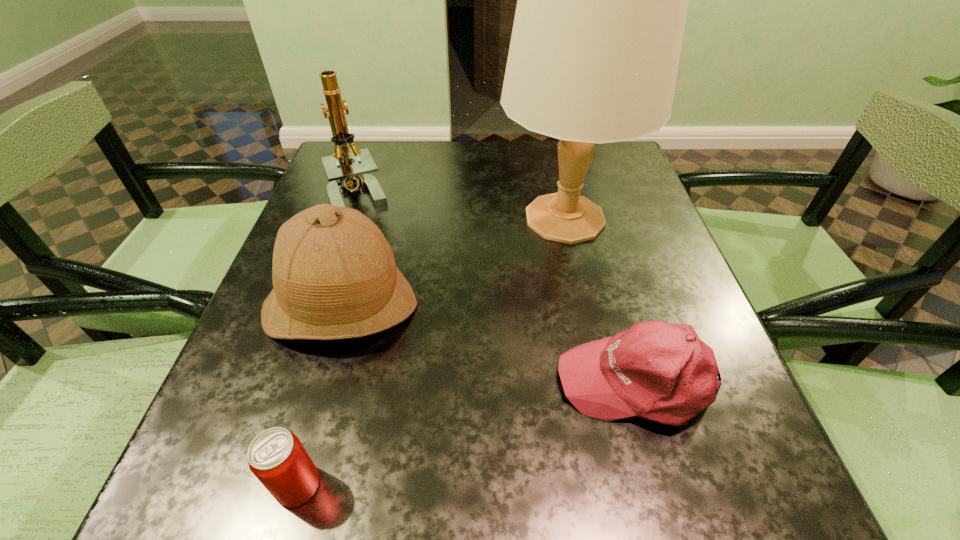
Find the location of a particular element. This screenshot has width=960, height=540. the tallest object is located at coordinates (602, 0).

Image resolution: width=960 pixels, height=540 pixels. I want to click on the second tallest object, so click(344, 175).

Where is `the third tallest object`? The height and width of the screenshot is (540, 960). the third tallest object is located at coordinates (334, 275).

Where is `baseball cap`? baseball cap is located at coordinates (663, 372).

Identify the location of the nearest object. (277, 458).

I want to click on vacant space positioned 0.060m on the back of the table lamp, so click(x=554, y=168).

At what (x,y) coordinates should I click in order to perform the action: click on vacant region located 0.360m at the eyepiece of the microscope. Please return your answer as a coordinate pair (x, y). The height and width of the screenshot is (540, 960). Looking at the image, I should click on (307, 348).

What are the coordinates of `vacant space located on the front-facing side of the hat` in the screenshot? It's located at (308, 418).

Locate an element on the screen. The height and width of the screenshot is (540, 960). free point located at the front of the baseball cap with the brim is located at coordinates (348, 381).

Where is `free location located 0.220m at the front of the baseball cap with the brim`? Image resolution: width=960 pixels, height=540 pixels. free location located 0.220m at the front of the baseball cap with the brim is located at coordinates [x=419, y=381].